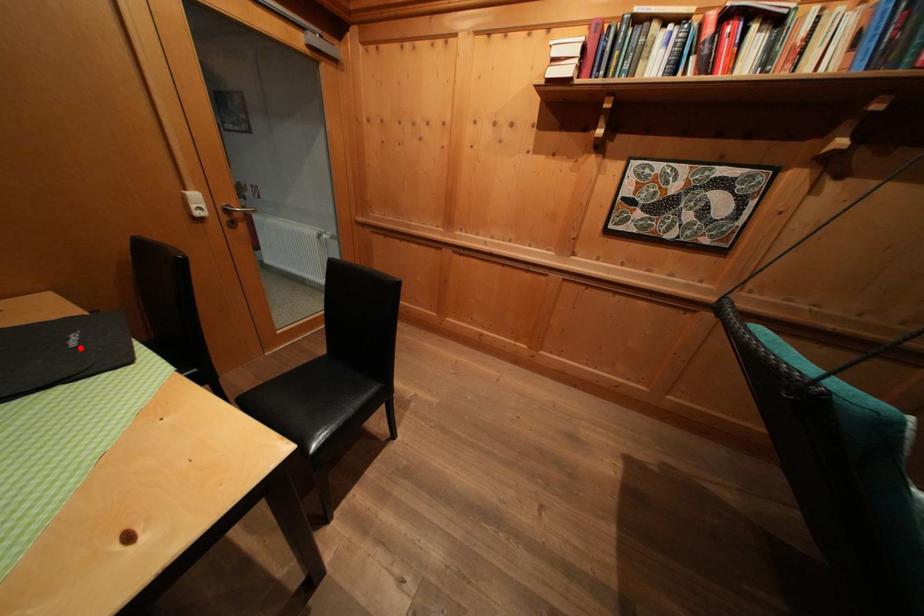
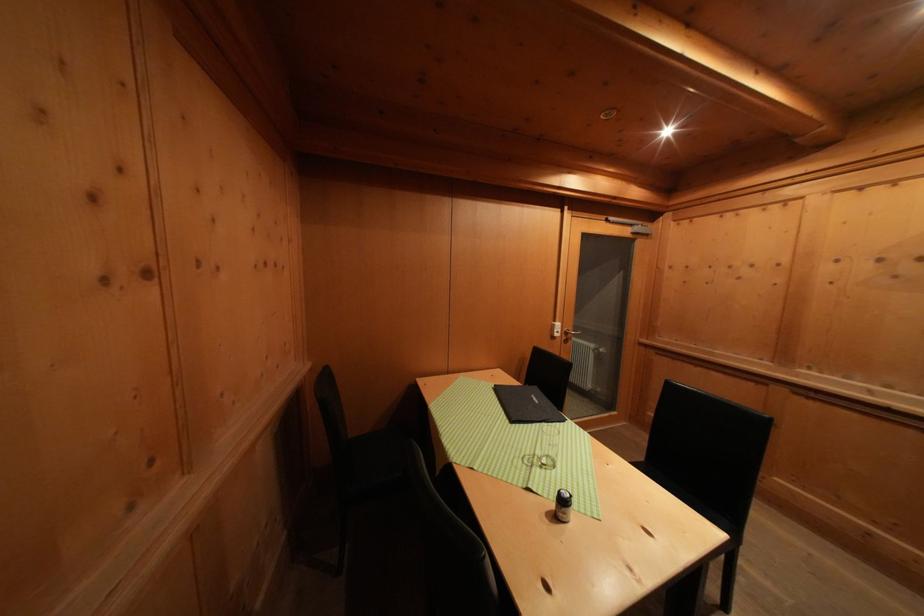
The point at the highlighted location is marked in the first image. Where is the corresponding point in the second image?

(542, 406)